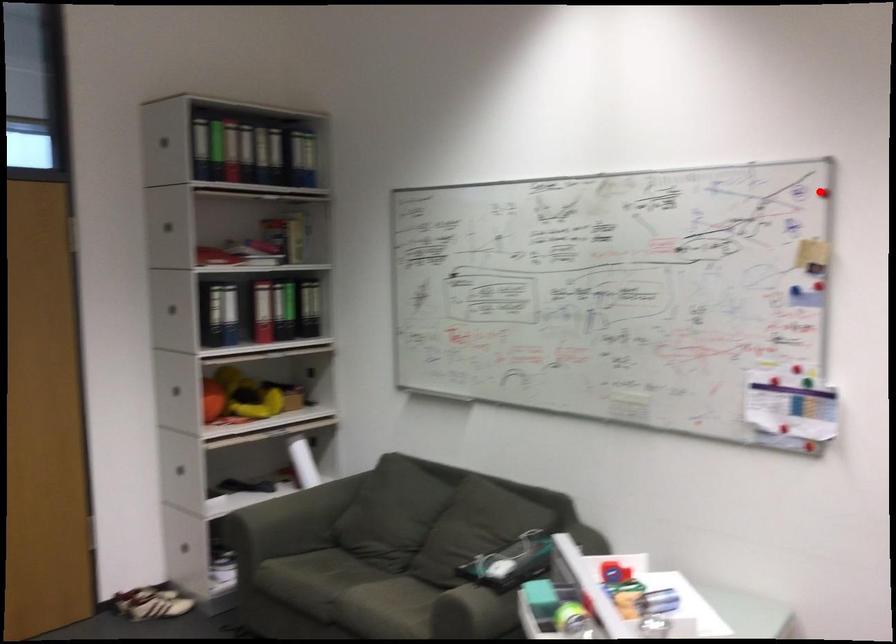
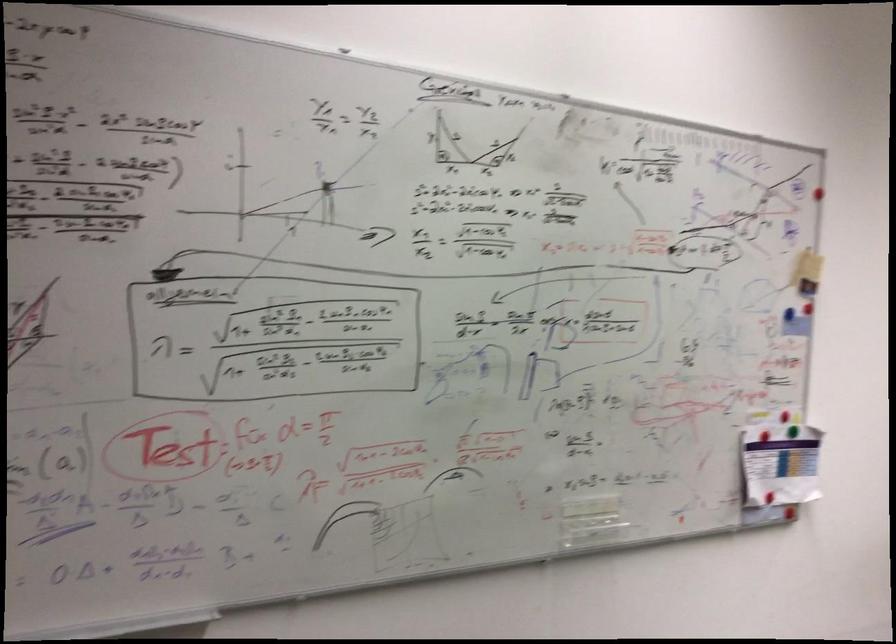
In the second image, find the point that corresponds to the highlighted location in the first image.

(817, 198)